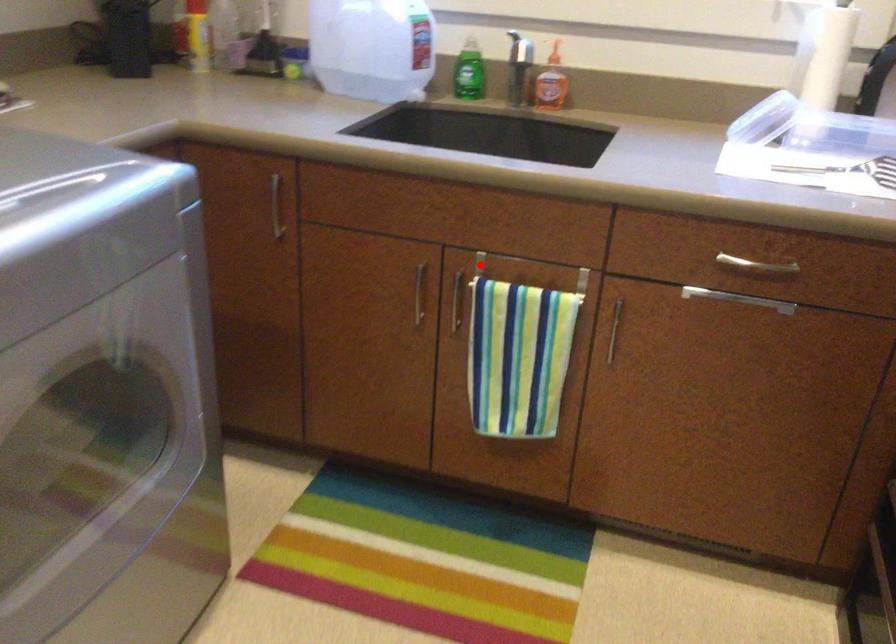
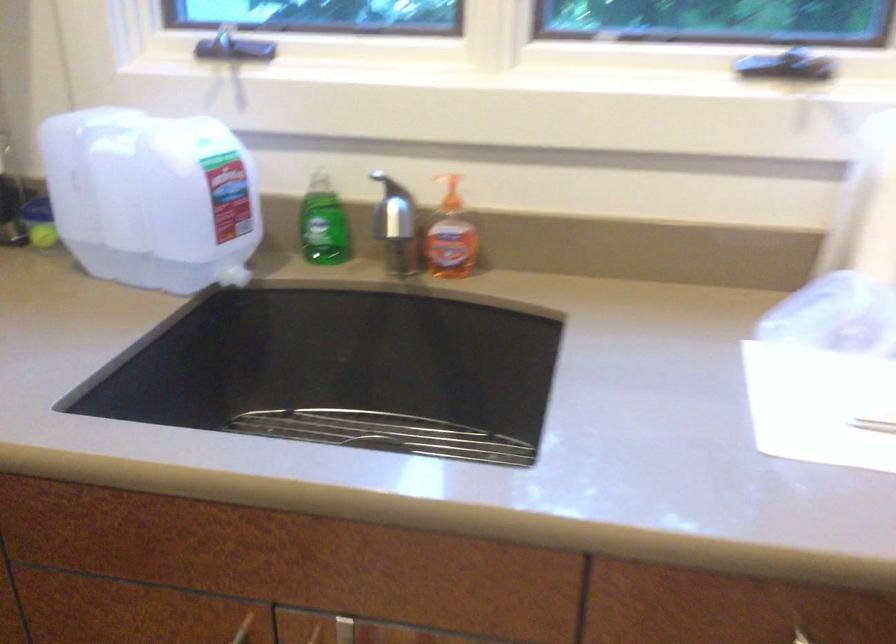
Where in the second image is the point corresponding to the highlighted location from the first image?

(343, 630)